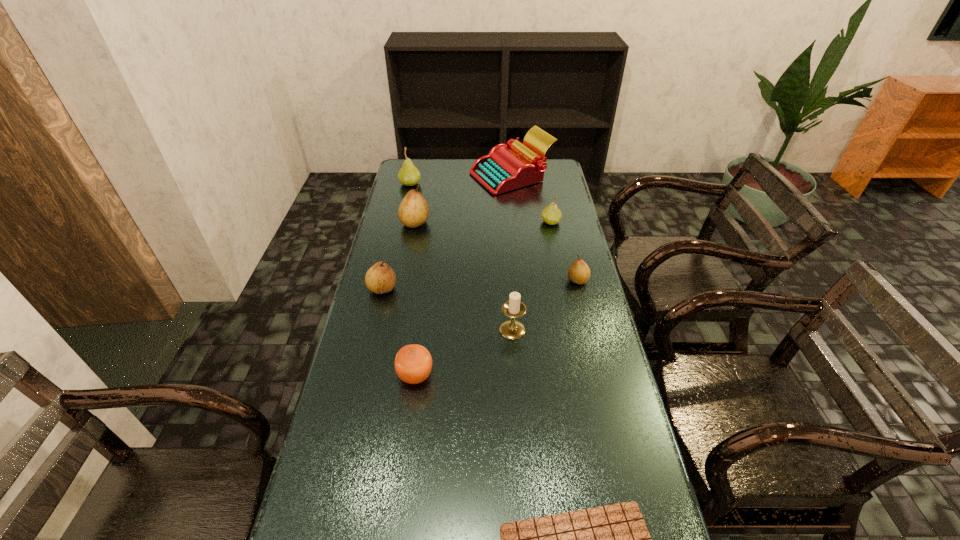
At what (x,y) coordinates should I click in order to perform the action: click on free point that satisfies the following two spatial constraints: 1. on the typing side of the typewriter; 2. on the front side of the white candle holder. Please return your answer as a coordinate pair (x, y). Looking at the image, I should click on click(x=527, y=330).